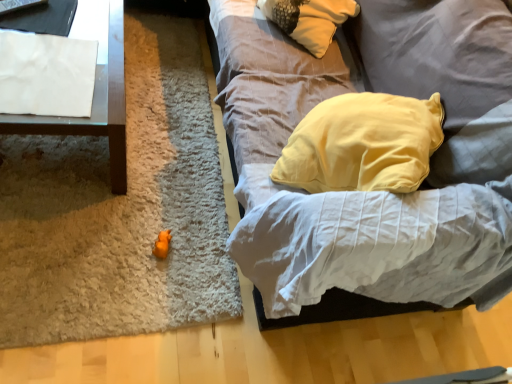
Question: In terms of width, does soft gray fabric couch at center look wider or thinner when compared to orange rubber duck at center?

Choices:
 (A) thin
 (B) wide

Answer: (B)

Question: From the image's perspective, is soft gray fabric couch at center positioned above or below orange rubber duck at center?

Choices:
 (A) above
 (B) below

Answer: (A)

Question: Estimate the real-world distances between objects in this image. Which object is farther from the orange plush mat at center?

Choices:
 (A) soft gray fabric couch at center
 (B) orange rubber duck at center
 (C) white paper at upper left
 (D) white paper at left

Answer: (A)

Question: Based on their relative distances, which object is farther from the orange plush mat at center?

Choices:
 (A) soft gray fabric couch at center
 (B) white paper at upper left
 (C) orange rubber duck at center
 (D) white paper at left

Answer: (A)